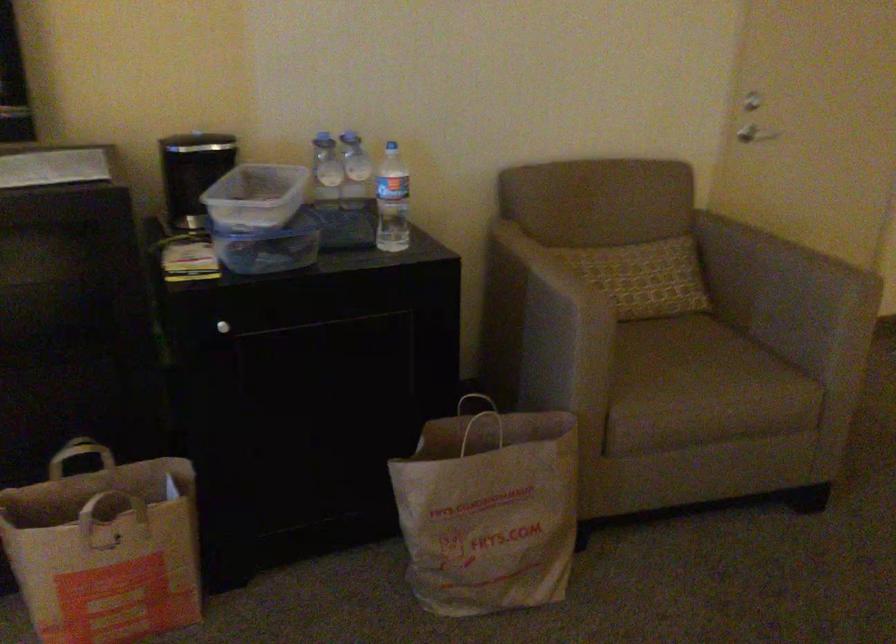
Describe the element at coordinates (707, 366) in the screenshot. I see `the chair sitting surface` at that location.